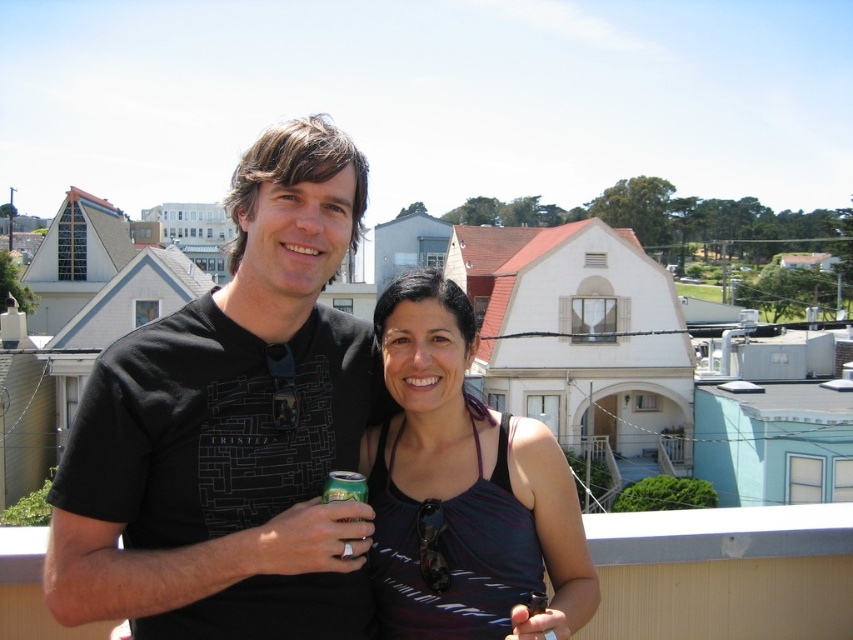
Question: Which point is farther from the camera taking this photo?

Choices:
 (A) (322, 493)
 (B) (527, 436)
 (C) (160, 417)

Answer: (B)

Question: Is black matte t-shirt at center further to the viewer compared to green metallic can at center?

Choices:
 (A) no
 (B) yes

Answer: (A)

Question: Which is nearer to the matte black tank top at center?

Choices:
 (A) black matte t-shirt at center
 (B) green metallic can at center

Answer: (B)

Question: Is the position of matte black tank top at center more distant than that of green metallic can at center?

Choices:
 (A) yes
 (B) no

Answer: (B)

Question: From the image, what is the correct spatial relationship of black matte t-shirt at center in relation to matte black tank top at center?

Choices:
 (A) above
 (B) below

Answer: (A)

Question: Which object is positioned closest to the black matte t-shirt at center?

Choices:
 (A) green metallic can at center
 (B) matte black tank top at center

Answer: (A)